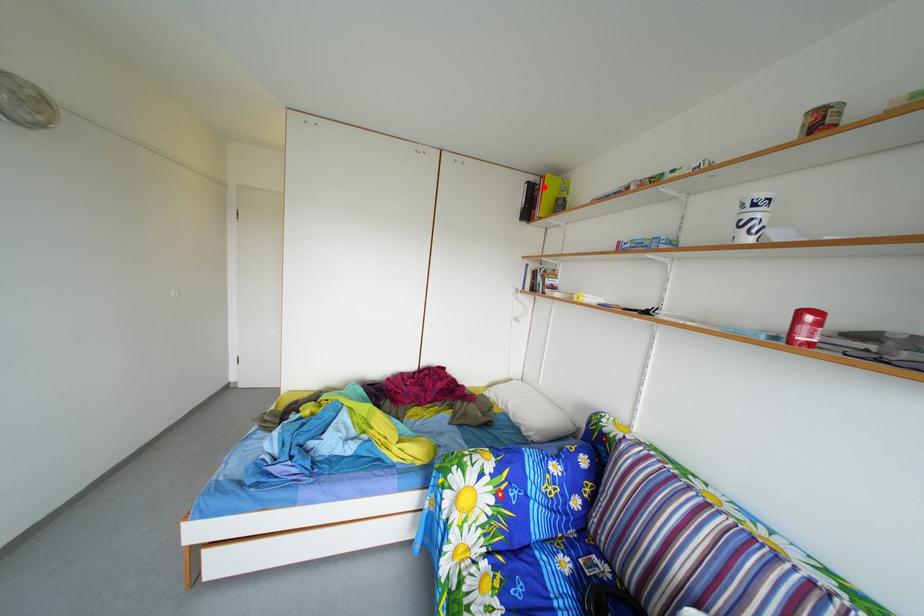
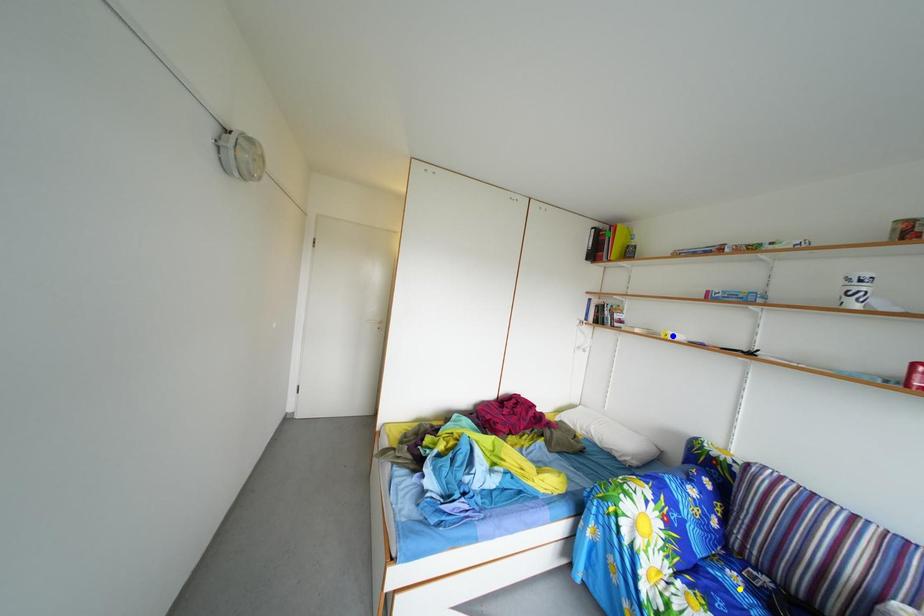
Question: I am providing you with two images of the same scene from different viewpoints. A red point is marked on the first image. You are given multiple points on the second image. Which point in image 2 is actually the same real-world point as the red point in image 1?

Choices:
 (A) yellow point
 (B) blue point
 (C) green point

Answer: (C)